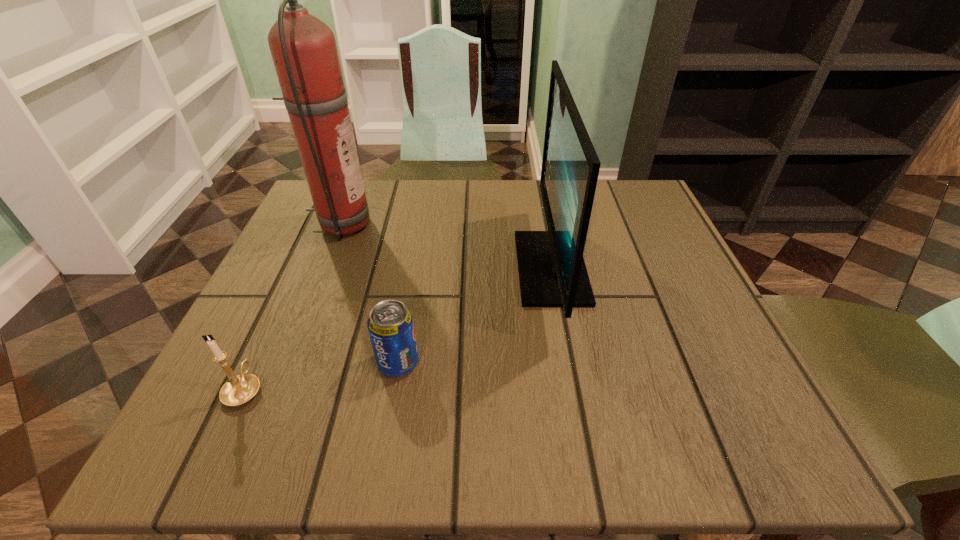
Locate an element on the screen. Image resolution: width=960 pixels, height=540 pixels. vacant space that satisfies the following two spatial constraints: 1. on the side of the tallest object with the label and nozzle; 2. on the right side of the soda is located at coordinates (285, 363).

Image resolution: width=960 pixels, height=540 pixels. Identify the location of vacant space that satisfies the following two spatial constraints: 1. on the side of the fire extinguisher with the label and nozzle; 2. on the left side of the third object from left to right. (285, 363).